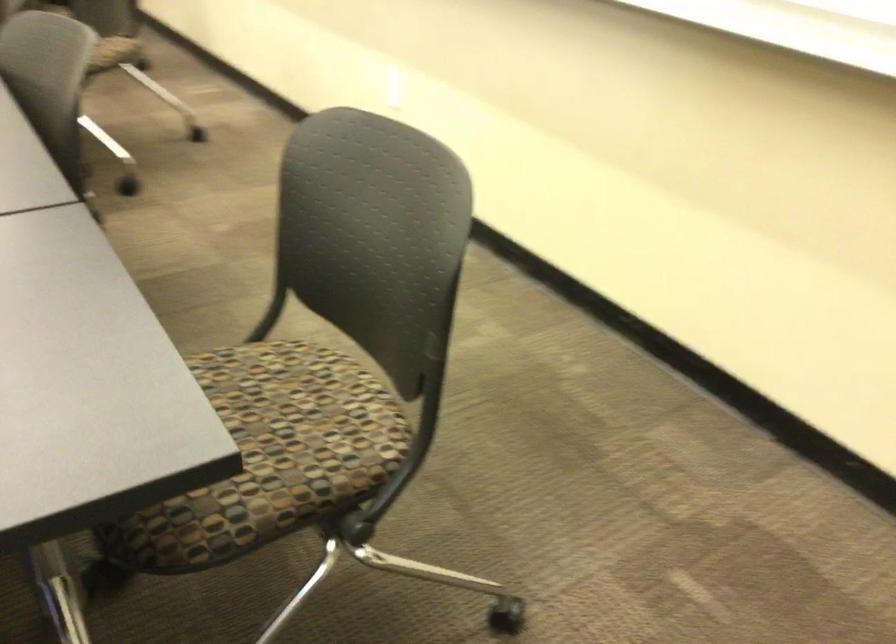
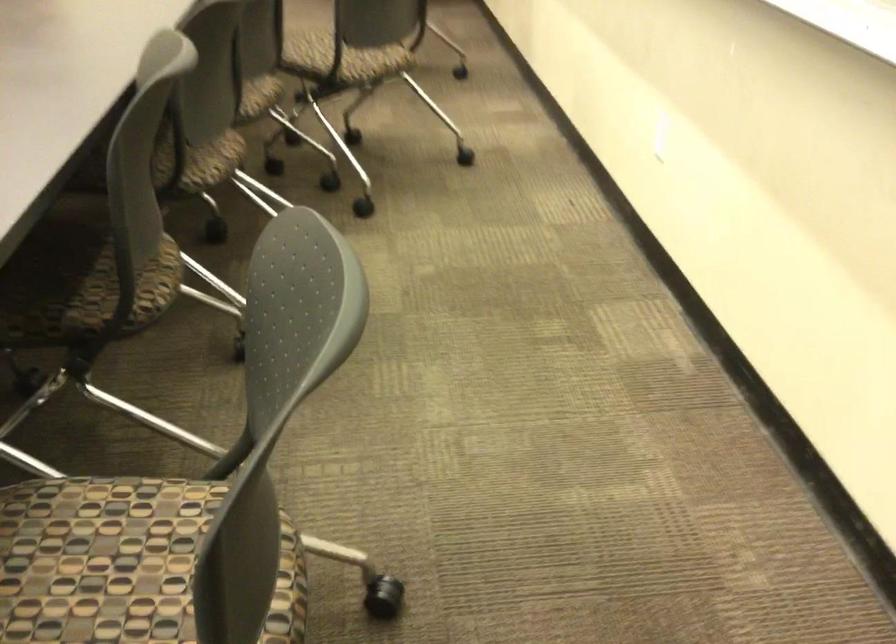
Where in the second image is the point corresponding to the point at 227,393 from the first image?

(99, 556)